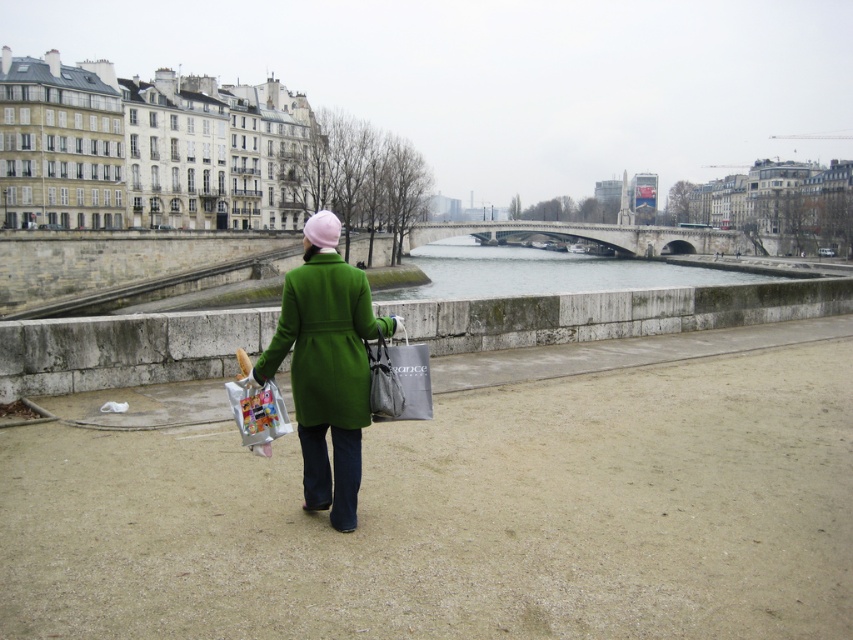
You are a photographer standing at the riverside path. You want to take a photo that includes both the point at position [351,358] and the point at position [374,355]. Which point will appear larger in your photo?

Point at position [351,358] will appear larger in the photo because it is closer to the camera than point at position [374,355].

You are a photographer trying to capture the clear water at center and the matte gray bag at center in a single frame. Which object should you focus on first if you want to ensure both are in sharp focus?

The clear water at center is bigger than the matte gray bag at center, so focusing on the clear water at center first would help ensure both are in sharp focus since it is larger and might be easier to focus on.

You are standing at the point marked by the coordinates point (541, 272). What can you see directly in front of you?

The point (541, 272) corresponds to clear water at center, so you can see clear water directly in front of you.